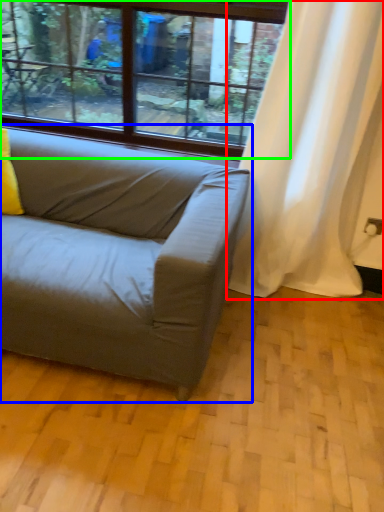
Question: Estimate the real-world distances between objects in this image. Which object is farther from curtain (highlighted by a red box), studio couch (highlighted by a blue box) or window (highlighted by a green box)?

Choices:
 (A) studio couch
 (B) window

Answer: (B)